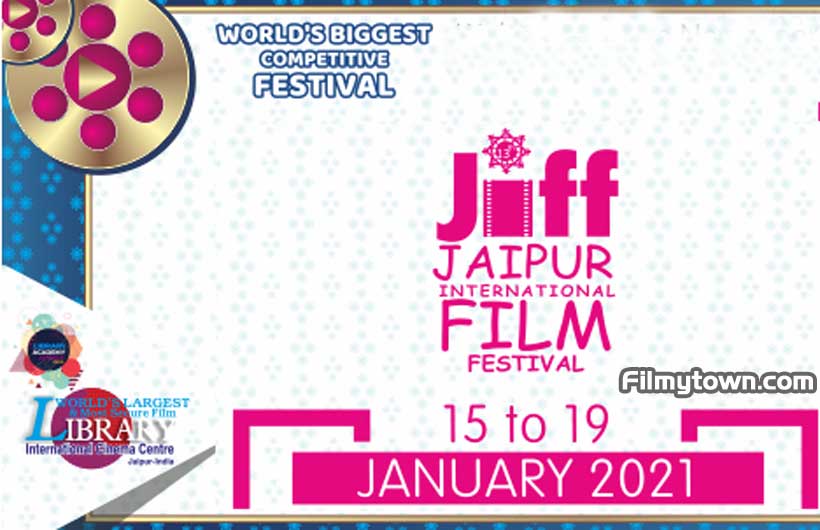
Find the location of `date banner`. date banner is located at coordinates (535, 465).